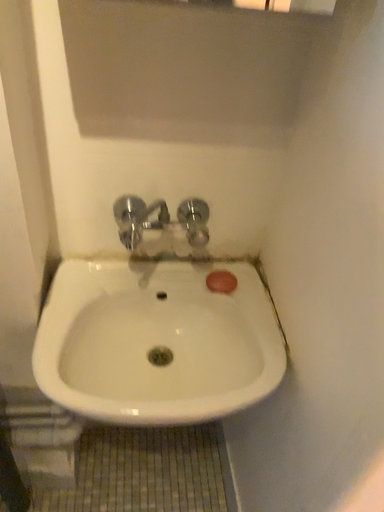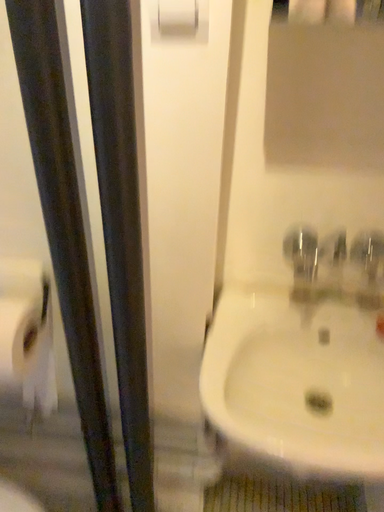
Question: Which way did the camera rotate in the video?

Choices:
 (A) rotated right
 (B) rotated left

Answer: (B)